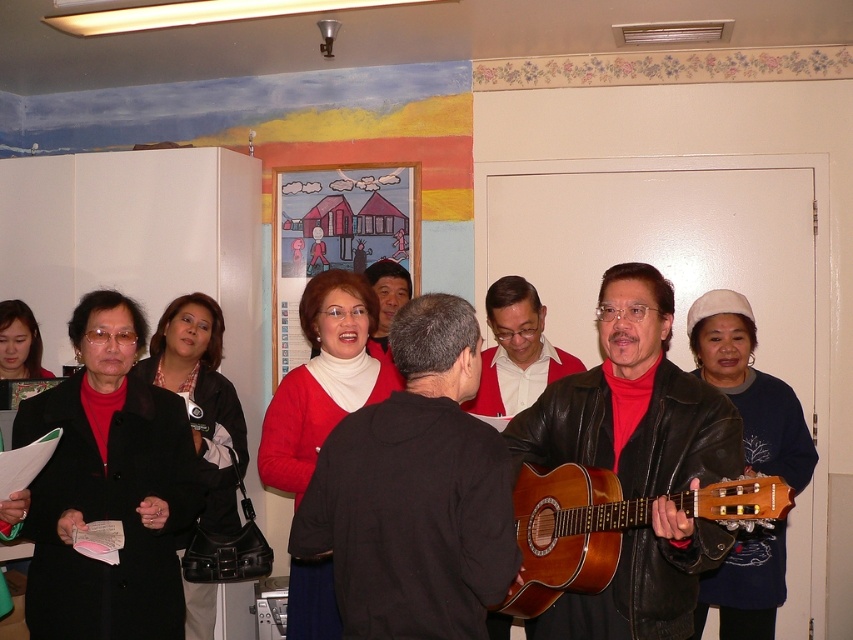
You are organizing a music event and need to place a stand for the sheet music. The stand is 1 meter tall. Considering the brown wooden guitar at center and the red matte sweater at center, which object is taller and can the stand accommodate both?

The brown wooden guitar at center is taller than the red matte sweater at center. Since the stand is 1 meter tall, it can accommodate both objects as the guitar is larger but still within the stand height.

Based on the photo, you are a stagehand who needs to move a 1.5 meter long equipment cart from the brown wooden guitar at center to the black leather jacket at left. Is there enough space for the cart to pass through the area between them?

The distance between the brown wooden guitar at center and the black leather jacket at left is 1.81 meters. Since the cart is 1.5 meters long, there is sufficient space for it to pass through as 1.81 meters is greater than 1.5 meters.

You are a photographer setting up for a group photo. You need to ensure that the matte black jacket at center and the brown wooden guitar at center are both visible in the frame. Given their sizes, which object should you focus on to make sure both are in the shot?

The matte black jacket at center is much taller than the brown wooden guitar at center, so focusing on the taller object will ensure both are in the frame.